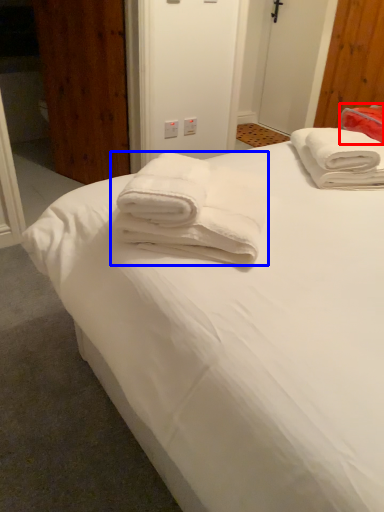
Question: Which of the following is the closest to the observer, cloth (highlighted by a red box) or towel (highlighted by a blue box)?

Choices:
 (A) cloth
 (B) towel

Answer: (B)